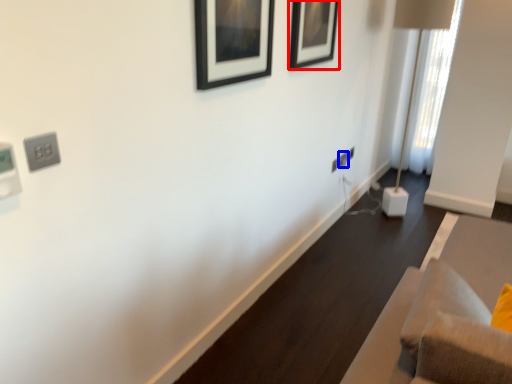
Question: Among these objects, which one is farthest to the camera, picture frame (highlighted by a red box) or electric outlet (highlighted by a blue box)?

Choices:
 (A) picture frame
 (B) electric outlet

Answer: (B)